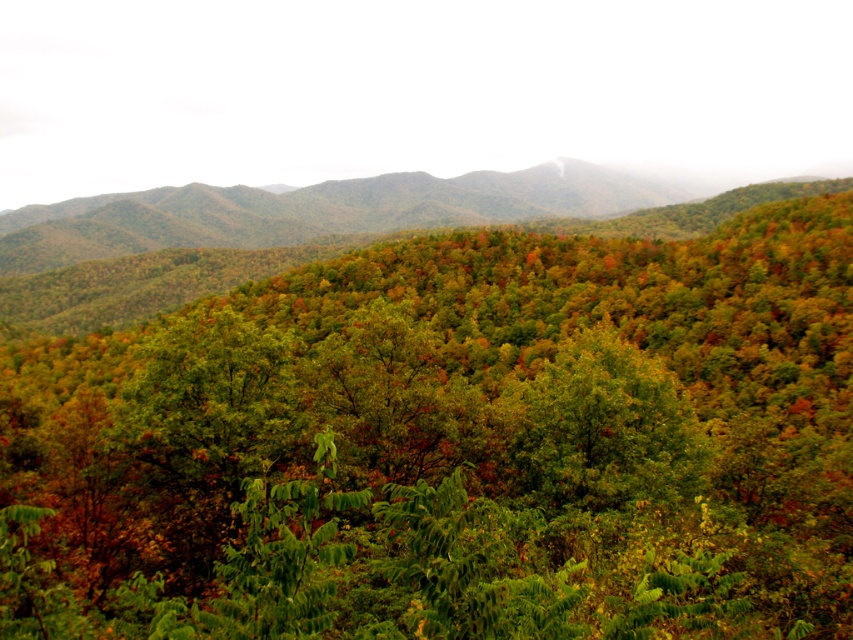
Question: Does green matte tree at center appear over green leafy forest at center?

Choices:
 (A) no
 (B) yes

Answer: (A)

Question: Which point is farther to the camera?

Choices:
 (A) (213, 349)
 (B) (457, 204)

Answer: (B)

Question: Can you confirm if green matte tree at center is bigger than green leafy forest at center?

Choices:
 (A) yes
 (B) no

Answer: (B)

Question: Does green matte tree at center have a greater width compared to green leafy forest at center?

Choices:
 (A) no
 (B) yes

Answer: (A)

Question: Which point is farther from the camera taking this photo?

Choices:
 (A) (71, 580)
 (B) (165, 216)

Answer: (B)